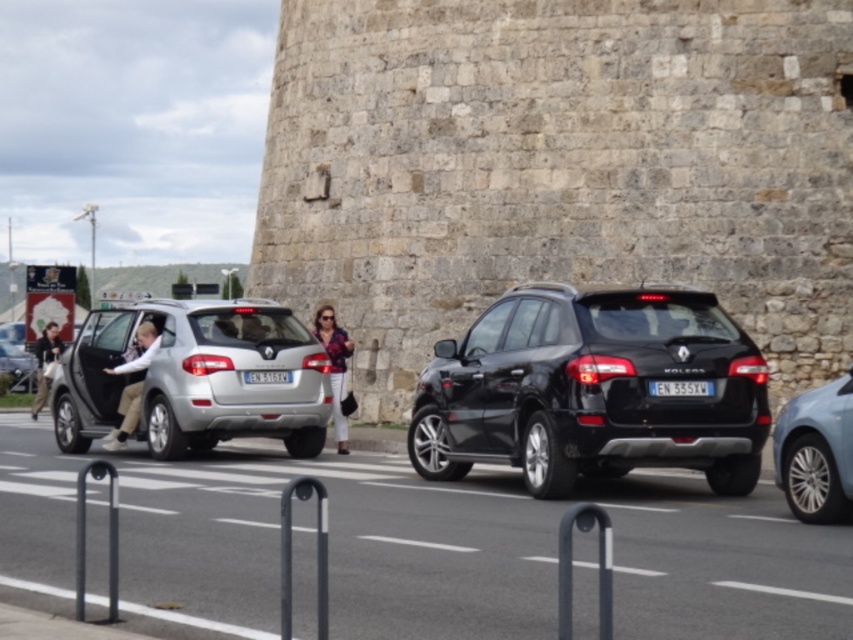
Which is in front, point (466, 3) or point (15, 362)?

Positioned in front is point (466, 3).

Does stone textured fort at center have a smaller size compared to silver metallic hatchback at left?

Actually, stone textured fort at center might be larger than silver metallic hatchback at left.

Does point (445, 83) come farther from viewer compared to point (13, 369)?

No, (445, 83) is in front of (13, 369).

The image size is (853, 640). Find the location of `stone textured fort at center`. stone textured fort at center is located at coordinates (558, 166).

Is black plastic license plate at center shorter than blue metallic license plate at center?

Indeed, black plastic license plate at center has a lesser height compared to blue metallic license plate at center.

Between black plastic license plate at center and blue metallic license plate at center, which one is positioned higher?

Positioned higher is black plastic license plate at center.

This screenshot has height=640, width=853. Describe the element at coordinates (682, 387) in the screenshot. I see `black plastic license plate at center` at that location.

Locate an element on the screen. The image size is (853, 640). black plastic license plate at center is located at coordinates (682, 387).

From the picture: Can you confirm if satin silver suv at center is positioned to the right of light blue metallic sedan at right?

In fact, satin silver suv at center is to the left of light blue metallic sedan at right.

Is satin silver suv at center wider than light blue metallic sedan at right?

Indeed, satin silver suv at center has a greater width compared to light blue metallic sedan at right.

Find the location of a particular element. This screenshot has height=640, width=853. satin silver suv at center is located at coordinates (196, 378).